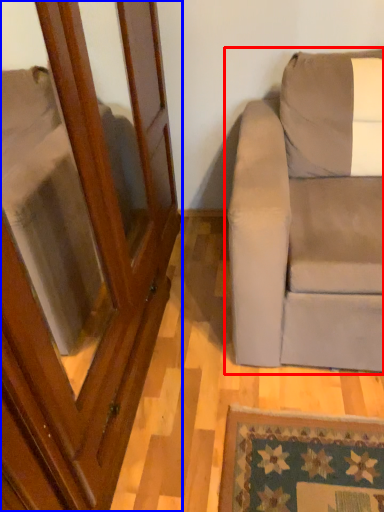
Question: Which object is further to the camera taking this photo, studio couch (highlighted by a red box) or screen door (highlighted by a blue box)?

Choices:
 (A) studio couch
 (B) screen door

Answer: (A)